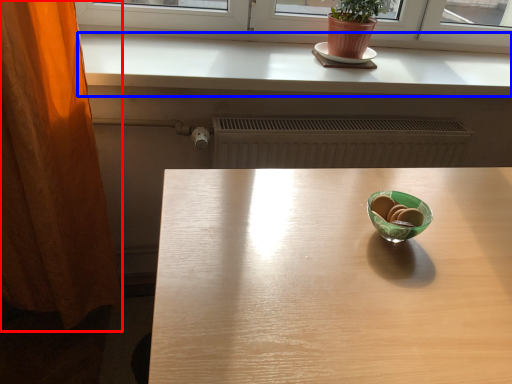
Question: Which object is closer to the camera taking this photo, curtain (highlighted by a red box) or counter top (highlighted by a blue box)?

Choices:
 (A) curtain
 (B) counter top

Answer: (A)